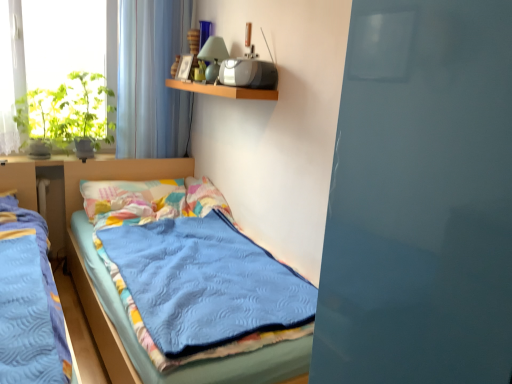
Question: Considering the relative sizes of green leafy plant at left, the first plant viewed from the right, and multicolored fabric pillow at center in the image provided, is green leafy plant at left, the first plant viewed from the right, taller than multicolored fabric pillow at center?

Choices:
 (A) yes
 (B) no

Answer: (A)

Question: From the image's perspective, does green leafy plant at left, arranged as the second plant when viewed from the left, appear lower than multicolored fabric pillow at center?

Choices:
 (A) no
 (B) yes

Answer: (A)

Question: Is multicolored fabric pillow at center at the back of green leafy plant at left, the first plant viewed from the right?

Choices:
 (A) yes
 (B) no

Answer: (B)

Question: Is green leafy plant at left, arranged as the second plant when viewed from the left, positioned far away from multicolored fabric pillow at center?

Choices:
 (A) no
 (B) yes

Answer: (A)

Question: Does green leafy plant at left, the first plant viewed from the right, have a larger size compared to multicolored fabric pillow at center?

Choices:
 (A) no
 (B) yes

Answer: (A)

Question: Would you say transparent glass window at upper left is inside or outside wooden shelf at upper center?

Choices:
 (A) outside
 (B) inside

Answer: (A)

Question: In terms of size, does transparent glass window at upper left appear bigger or smaller than wooden shelf at upper center?

Choices:
 (A) small
 (B) big

Answer: (B)

Question: Would you say transparent glass window at upper left is to the left or to the right of wooden shelf at upper center in the picture?

Choices:
 (A) right
 (B) left

Answer: (B)

Question: Considering the positions of point (162, 48) and point (165, 84), is point (162, 48) closer or farther from the camera than point (165, 84)?

Choices:
 (A) farther
 (B) closer

Answer: (B)

Question: Considering the positions of point (204, 79) and point (202, 91), is point (204, 79) closer or farther from the camera than point (202, 91)?

Choices:
 (A) farther
 (B) closer

Answer: (A)

Question: In the image, is matte green glass lamp at upper center on the left side or the right side of wooden shelf at upper center?

Choices:
 (A) left
 (B) right

Answer: (A)

Question: In terms of size, does matte green glass lamp at upper center appear bigger or smaller than wooden shelf at upper center?

Choices:
 (A) small
 (B) big

Answer: (A)

Question: Is matte green glass lamp at upper center taller or shorter than wooden shelf at upper center?

Choices:
 (A) short
 (B) tall

Answer: (B)

Question: From a real-world perspective, relative to wooden shelf at upper center, is green leafy plant at left, the first plant viewed from the right, vertically above or below?

Choices:
 (A) below
 (B) above

Answer: (A)

Question: In terms of size, does green leafy plant at left, arranged as the second plant when viewed from the left, appear bigger or smaller than wooden shelf at upper center?

Choices:
 (A) big
 (B) small

Answer: (A)